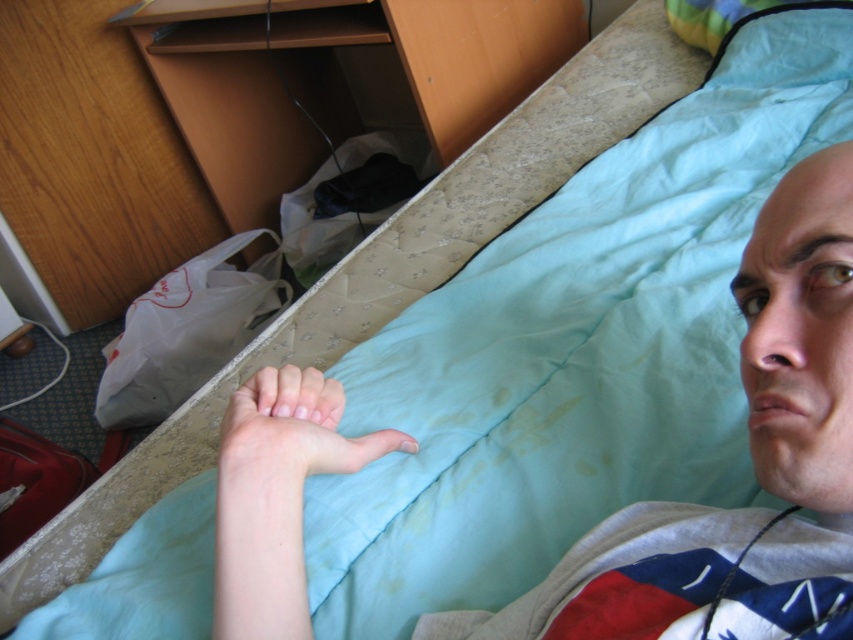
You are standing in the bedroom and want to reach the point at coordinates (299, 410). If your arm can extend 20 inches, can you reach that point without moving?

The point at coordinates (299, 410) is 23.52 inches away from you, which is beyond your arm reach of 20 inches. You cannot reach it without moving.

You are a healthcare worker checking the patient in the image. You need to monitor the skin condition of the pale skin at lower center and the pale skin hand at lower center. Which part is closer to the bottom of the image?

The pale skin at lower center is closer to the bottom of the image because it is below the pale skin hand at lower center.

Consider the image. You are a nurse checking the patient in the bed. You need to determine if the patient can reach their hand to their face without moving their body. Based on the height difference between the pale skin at lower center and the pale skin hand at lower center, can they do this?

The pale skin at lower center has a greater height compared to the pale skin hand at lower center, so the patient can reach their hand to their face without moving their body since the hand is lower and the face is higher.